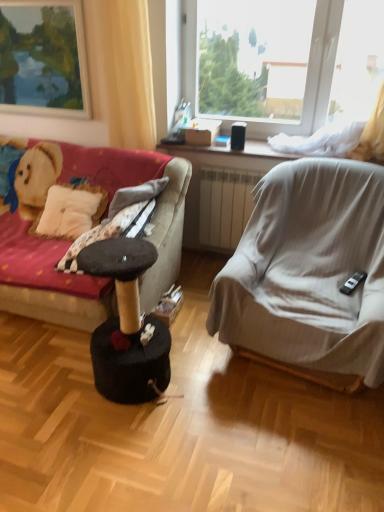
Where is `free space to the left of black felt cat tree at center`? Image resolution: width=384 pixels, height=512 pixels. free space to the left of black felt cat tree at center is located at coordinates (47, 372).